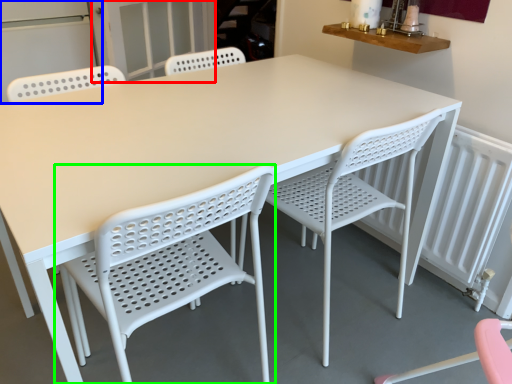
Question: Estimate the real-world distances between objects in this image. Which object is closer to screen door (highlighted by a red box), screen door (highlighted by a blue box) or chair (highlighted by a green box)?

Choices:
 (A) screen door
 (B) chair

Answer: (A)